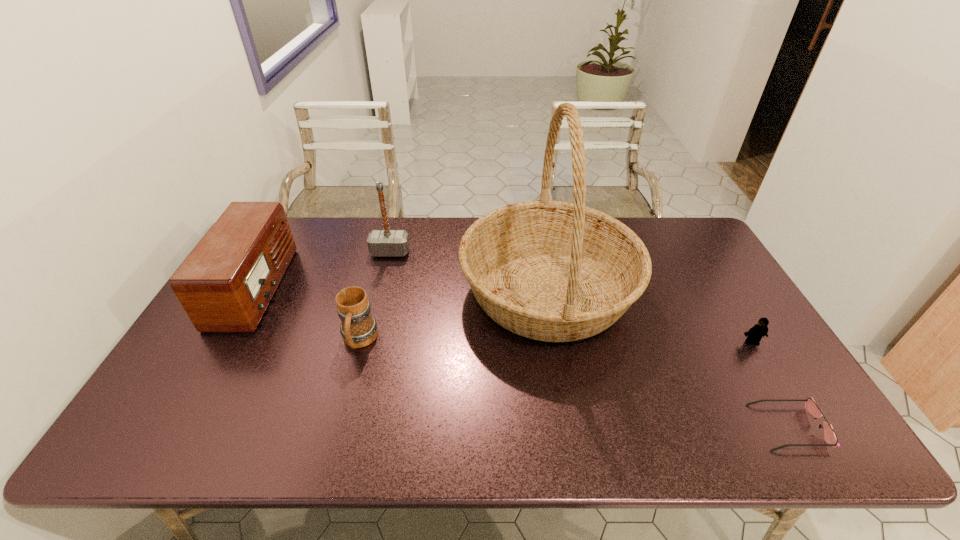
Locate an element on the screen. the tallest object is located at coordinates (553, 271).

This screenshot has height=540, width=960. In order to click on the fourth object from left to right in this screenshot , I will do `click(553, 271)`.

Locate an element on the screen. hammer is located at coordinates (386, 242).

Image resolution: width=960 pixels, height=540 pixels. I want to click on the fourth shortest object, so click(226, 283).

This screenshot has width=960, height=540. I want to click on radio receiver, so click(226, 283).

Locate an element on the screen. The height and width of the screenshot is (540, 960). mug is located at coordinates (358, 328).

At what (x,y) coordinates should I click in order to perform the action: click on Lego. Please return your answer as a coordinate pair (x, y). Image resolution: width=960 pixels, height=540 pixels. Looking at the image, I should click on (754, 335).

Find the location of a particular element. The width and height of the screenshot is (960, 540). sunglasses is located at coordinates (830, 437).

You are a GUI agent. You are given a task and a screenshot of the screen. Output one action in this format:
    pyautogui.click(x=<x>, y=<y>)
    Task: Click on the shortest object
    
    Given the screenshot: What is the action you would take?
    pyautogui.click(x=830, y=437)

This screenshot has width=960, height=540. Identify the location of vacant position located on the right of the tallest object. (705, 291).